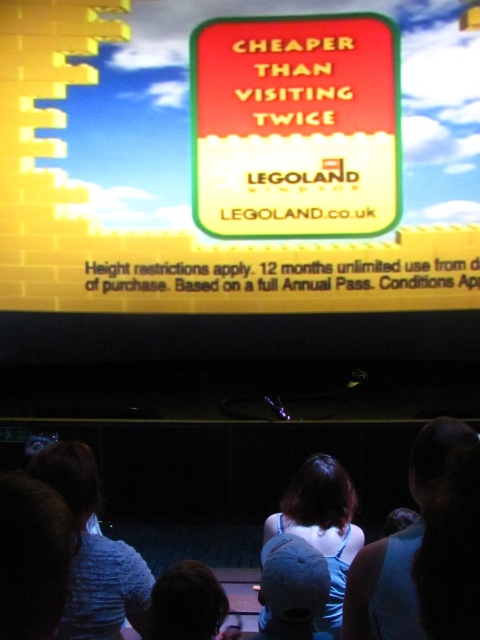
Question: In this image, where is white fabric at center located relative to denim cap at center?

Choices:
 (A) above
 (B) below

Answer: (B)

Question: Based on their relative distances, which object is farther from the white fabric at center?

Choices:
 (A) light blue shirt at lower left
 (B) red glossy sign at upper center
 (C) light blue denim shirt at center

Answer: (B)

Question: Which object is closer to the camera taking this photo?

Choices:
 (A) light blue denim shirt at center
 (B) dark blue fabric shirt at center
 (C) light blue shirt at lower left

Answer: (C)

Question: Which object is positioned closest to the light blue shirt at lower left?

Choices:
 (A) dark blue fabric shirt at center
 (B) denim cap at center

Answer: (B)

Question: Does light blue denim shirt at center have a smaller size compared to white fabric at center?

Choices:
 (A) yes
 (B) no

Answer: (B)

Question: Is light blue denim shirt at center above denim cap at center?

Choices:
 (A) yes
 (B) no

Answer: (B)